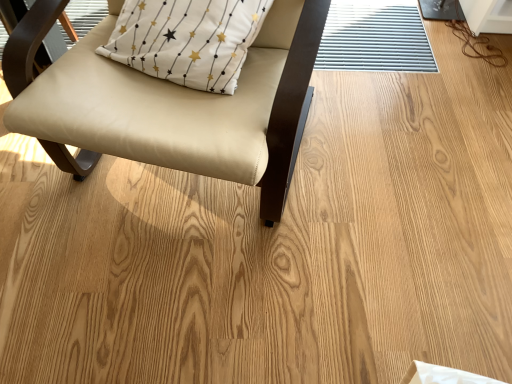
The width and height of the screenshot is (512, 384). I want to click on vacant area that is in front of beige leather chair at upper left, so click(x=183, y=304).